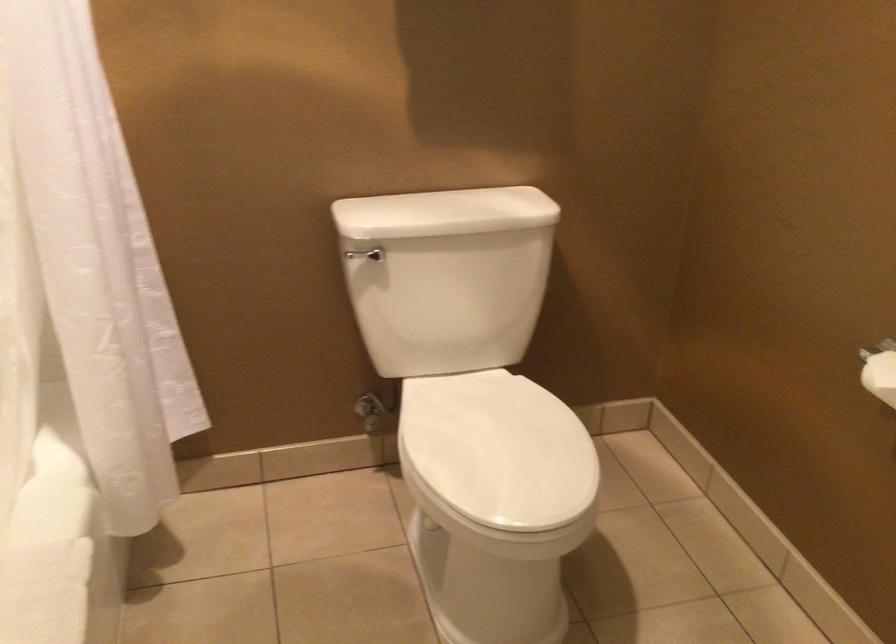
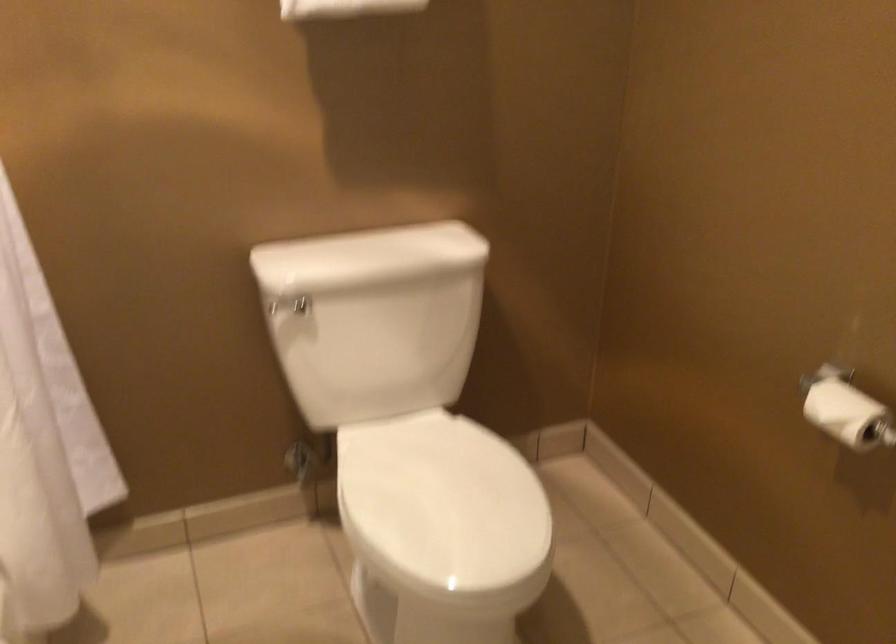
In the second image, find the point that corresponds to pixel 364 254 in the first image.

(289, 307)